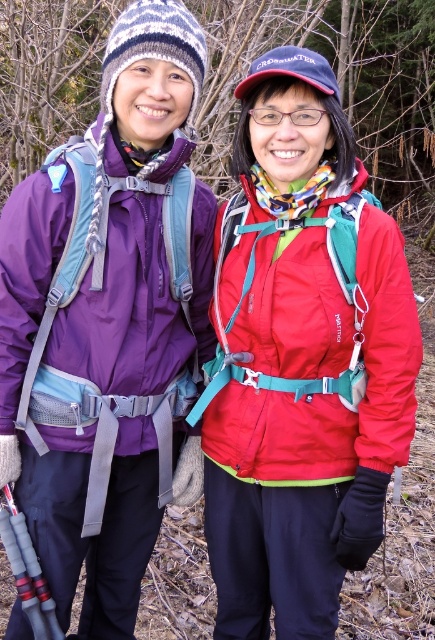
You are trying to locate two hikers in a photo. The scene has a matte purple jacket at left and a matte red jacket at center. Which hiker is positioned further to the left?

The matte purple jacket at left is positioned further to the left than the matte red jacket at center.

You are a photographer trying to capture a photo of both the person on the left and the person on the right in the scene. You notice two points marked in the image. One is at point [53,305] and the other is at point [335,266]. Which point is closer to you, the photographer, and should be used as the focal point for better depth perception?

Point [53,305] is further to the viewer than point [335,266], so the photographer should use point [53,305] as the focal point for better depth perception since it is closer to them.